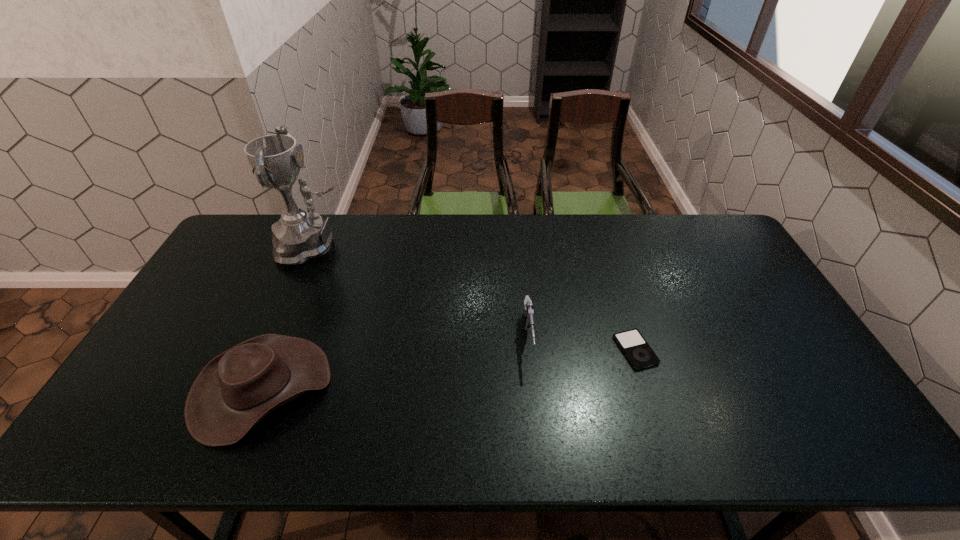
Identify the location of award. The height and width of the screenshot is (540, 960). (300, 235).

Locate an element on the screen. the farthest object is located at coordinates (300, 235).

This screenshot has width=960, height=540. What are the coordinates of `cowboy hat` in the screenshot? It's located at (237, 389).

This screenshot has height=540, width=960. I want to click on gun, so click(528, 310).

Where is `iPod`? The height and width of the screenshot is (540, 960). iPod is located at coordinates (639, 353).

What are the coordinates of `the shortest object` in the screenshot? It's located at (639, 353).

At what (x,y) coordinates should I click in order to perform the action: click on blank space located on the side with emblem of the tallest object. Please return your answer as a coordinate pair (x, y). This screenshot has width=960, height=540. Looking at the image, I should click on (401, 246).

This screenshot has height=540, width=960. In order to click on blank space located on the right of the cowboy hat in this screenshot , I will do `click(348, 388)`.

You are a GUI agent. You are given a task and a screenshot of the screen. Output one action in this format:
    pyautogui.click(x=<x>, y=<y>)
    Task: Click on the free space located at the barrel of the gun
    This screenshot has height=540, width=960.
    Given the screenshot: What is the action you would take?
    pyautogui.click(x=536, y=406)

Identify the location of blank space located on the left of the iPod. (507, 350).